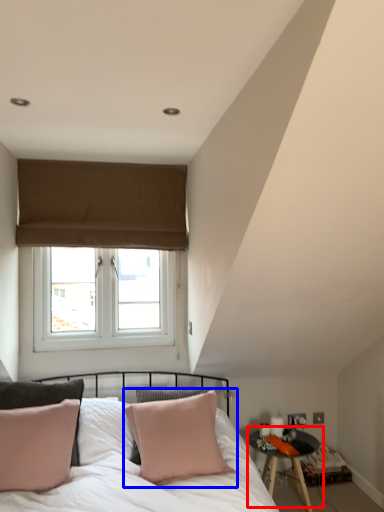
Question: Which of the following is the farthest to the observer, table (highlighted by a red box) or pillow (highlighted by a blue box)?

Choices:
 (A) table
 (B) pillow

Answer: (A)